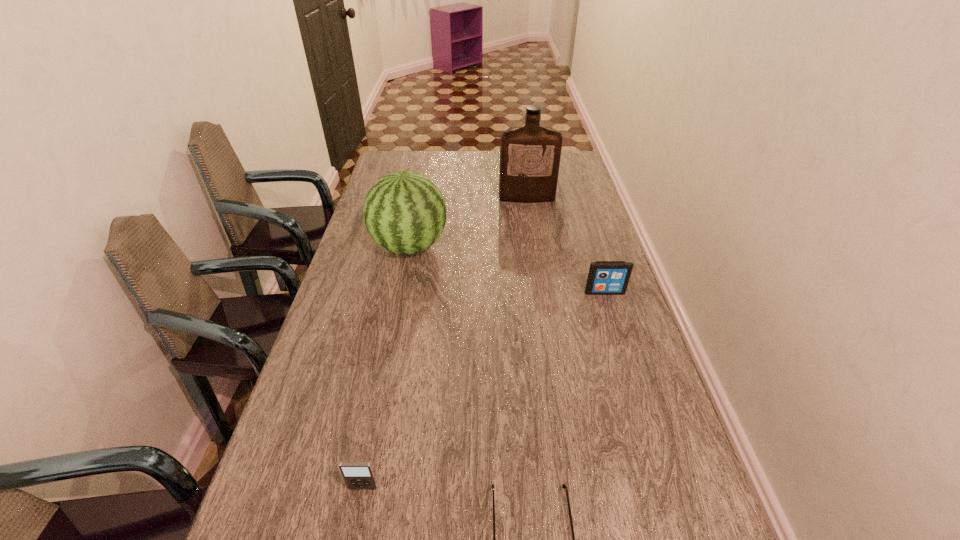
Find the location of a particular element. This screenshot has height=540, width=960. the tallest object is located at coordinates (530, 155).

At what (x,y) coordinates should I click in order to perform the action: click on liquor. Please return your answer as a coordinate pair (x, y). The width and height of the screenshot is (960, 540). Looking at the image, I should click on (530, 155).

At what (x,y) coordinates should I click in order to perform the action: click on the fourth nearest object. Please return your answer as a coordinate pair (x, y). The width and height of the screenshot is (960, 540). Looking at the image, I should click on (404, 212).

Image resolution: width=960 pixels, height=540 pixels. Find the location of `the fourth shortest object`. the fourth shortest object is located at coordinates (404, 212).

Locate an element on the screen. The image size is (960, 540). the right iPod is located at coordinates (605, 277).

Where is `the farther iPod`? the farther iPod is located at coordinates (605, 277).

In order to click on the fourth tallest object in this screenshot , I will do `click(358, 475)`.

You are a GUI agent. You are given a task and a screenshot of the screen. Output one action in this format:
    pyautogui.click(x=<x>, y=<y>)
    Task: Click on the left iPod
    
    Given the screenshot: What is the action you would take?
    pyautogui.click(x=358, y=475)

Find the location of a particular element. This screenshot has width=960, height=540. free spot located on the label side of the liquor is located at coordinates (536, 255).

This screenshot has height=540, width=960. Find the location of `vacant region located on the front of the second farthest object`. vacant region located on the front of the second farthest object is located at coordinates (395, 323).